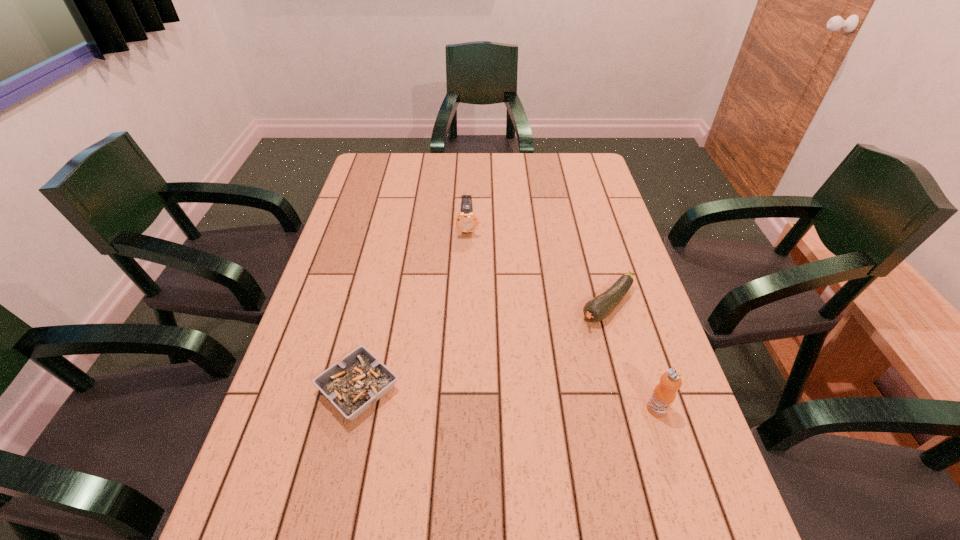
Image resolution: width=960 pixels, height=540 pixels. In order to click on free space between the ashtray and the watch in this screenshot , I will do pos(414,308).

What are the coordinates of `vacant region between the ashtray and the zucchini` in the screenshot? It's located at (483, 347).

The image size is (960, 540). In order to click on free spot between the zucchini and the farthest object in this screenshot , I will do `click(538, 267)`.

Identify the location of free space between the leftmost object and the orange juice. (508, 399).

Where is `free area in between the tallest object and the leftmost object`? free area in between the tallest object and the leftmost object is located at coordinates (508, 399).

Identify which object is located as the second nearest to the leftmost object. Please provide its 2D coordinates. Your answer should be formatted as a tuple, i.e. [(x, y)], where the tuple contains the x and y coordinates of a point satisfying the conditions above.

[(466, 221)]

Locate which object is the second closest to the orange juice. Please provide its 2D coordinates. Your answer should be formatted as a tuple, i.e. [(x, y)], where the tuple contains the x and y coordinates of a point satisfying the conditions above.

[(353, 385)]

Locate an element on the screen. The height and width of the screenshot is (540, 960). vacant space that satisfies the following two spatial constraints: 1. on the back side of the shortest object; 2. on the left side of the zucchini is located at coordinates (377, 306).